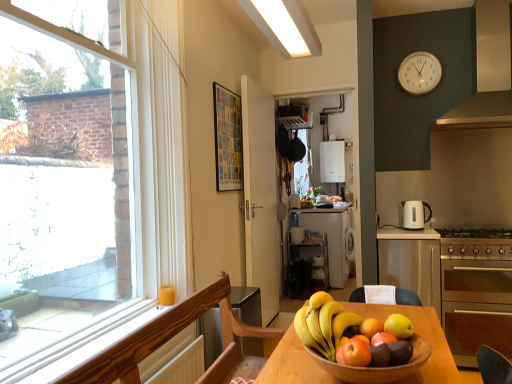
At what (x,y) coordinates should I click in order to perform the action: click on shiny green apple at center, the 2th apple in the front-to-back sequence. Please return your answer as a coordinate pair (x, y). The height and width of the screenshot is (384, 512). Looking at the image, I should click on (380, 355).

Image resolution: width=512 pixels, height=384 pixels. Describe the element at coordinates (308, 266) in the screenshot. I see `black plastic shelf at center, the 2th appliance in the back-to-front sequence` at that location.

Describe the element at coordinates (152, 137) in the screenshot. I see `clear glass window at left` at that location.

I want to click on shiny red apple at lower center, the fourth apple positioned from the back, so click(400, 352).

The image size is (512, 384). What do you see at coordinates (400, 352) in the screenshot?
I see `shiny red apple at lower center, the third apple viewed from the front` at bounding box center [400, 352].

What do you see at coordinates (335, 161) in the screenshot?
I see `white glossy boiler at center, which is the second appliance in left-to-right order` at bounding box center [335, 161].

The image size is (512, 384). What do you see at coordinates (333, 238) in the screenshot?
I see `white matte dishwasher at center` at bounding box center [333, 238].

The image size is (512, 384). I want to click on shiny green apple at center, the 2th apple in the front-to-back sequence, so click(x=380, y=355).

Considering the sizes of objects shiny red apple at center, arranged as the fourth apple when viewed from the front, and shiny yellow apple at center, the first apple when ordered from back to front, in the image provided, who is smaller, shiny red apple at center, arranged as the fourth apple when viewed from the front, or shiny yellow apple at center, the first apple when ordered from back to front,?

shiny red apple at center, arranged as the fourth apple when viewed from the front.

How different are the orientations of shiny red apple at center, arranged as the fourth apple when viewed from the front, and shiny yellow apple at center, the sixth apple when ordered from front to back, in degrees?

180 degrees separate the facing orientations of shiny red apple at center, arranged as the fourth apple when viewed from the front, and shiny yellow apple at center, the sixth apple when ordered from front to back.

From the image's perspective, count 4th apples downward from the shiny yellow apple at center, the sixth apple when ordered from front to back, and point to it. Please provide its 2D coordinates.

[(383, 338)]

Is shiny red apple at center, arranged as the third apple when viewed from the back, facing towards shiny yellow apple at center, the first apple when ordered from back to front?

Yes, shiny red apple at center, arranged as the third apple when viewed from the back, faces towards shiny yellow apple at center, the first apple when ordered from back to front.

From the image's perspective, which is above, wooden bowl at center or shiny red apple at lower center, the third apple viewed from the front?

shiny red apple at lower center, the third apple viewed from the front, is shown above in the image.

Which point is more forward, (346,377) or (398,359)?

The point (346,377) is closer.

Does wooden bowl at center have a lesser width compared to shiny red apple at lower center, the third apple viewed from the front?

No, wooden bowl at center is not thinner than shiny red apple at lower center, the third apple viewed from the front.

Between wooden bowl at center and shiny red apple at lower center, the fourth apple positioned from the back, which one has larger size?

Bigger between the two is wooden bowl at center.

Considering the relative sizes of white glossy electric kettle at right and satin silver exhaust hood at upper right in the image provided, is white glossy electric kettle at right smaller than satin silver exhaust hood at upper right?

Correct, white glossy electric kettle at right occupies less space than satin silver exhaust hood at upper right.

Considering the sizes of objects white glossy electric kettle at right and satin silver exhaust hood at upper right in the image provided, who is thinner, white glossy electric kettle at right or satin silver exhaust hood at upper right?

With smaller width is white glossy electric kettle at right.

Considering the positions of objects white glossy electric kettle at right and satin silver exhaust hood at upper right in the image provided, who is more to the left, white glossy electric kettle at right or satin silver exhaust hood at upper right?

Positioned to the left is white glossy electric kettle at right.

Is satin silver exhaust hood at upper right surrounded by white glossy electric kettle at right?

No, satin silver exhaust hood at upper right is not surrounded by white glossy electric kettle at right.

Would you say wooden chair at lower left is inside or outside shiny red apple at center, arranged as the fourth apple when viewed from the front?

wooden chair at lower left is not enclosed by shiny red apple at center, arranged as the fourth apple when viewed from the front.

Which of these two, wooden chair at lower left or shiny red apple at center, arranged as the third apple when viewed from the back, stands shorter?

shiny red apple at center, arranged as the third apple when viewed from the back, is shorter.

Consider the image. Is wooden chair at lower left further to the viewer compared to shiny red apple at center, arranged as the fourth apple when viewed from the front?

No, wooden chair at lower left is in front of shiny red apple at center, arranged as the fourth apple when viewed from the front.

Locate an element on the screen. chair in front of the shiny red apple at center, arranged as the fourth apple when viewed from the front is located at coordinates (163, 337).

Does white matte door at center have a lesser width compared to white glossy boiler at center, which is the first appliance from right to left?

Yes, white matte door at center is thinner than white glossy boiler at center, which is the first appliance from right to left.

At what (x,y) coordinates should I click in order to perform the action: click on appliance that is the 2nd object located behind the white matte door at center. Please return your answer as a coordinate pair (x, y). The image size is (512, 384). Looking at the image, I should click on (335, 161).

Is white matte door at center not inside white glossy boiler at center, which appears as the 1th appliance when viewed from the top?

Yes, white matte door at center is not within white glossy boiler at center, which appears as the 1th appliance when viewed from the top.

Could you tell me if white matte door at center is facing white glossy boiler at center, which appears as the 1th appliance when viewed from the top?

No, white matte door at center is not oriented towards white glossy boiler at center, which appears as the 1th appliance when viewed from the top.

Is white glossy boiler at center, which is the first appliance from right to left, in front of or behind shiny red apple at center, arranged as the third apple when viewed from the back, in the image?

white glossy boiler at center, which is the first appliance from right to left, is behind shiny red apple at center, arranged as the third apple when viewed from the back.

Between white glossy boiler at center, which is the 2th appliance in bottom-to-top order, and shiny red apple at center, arranged as the fourth apple when viewed from the front, which one has larger size?

white glossy boiler at center, which is the 2th appliance in bottom-to-top order, is bigger.

Considering the relative positions of white glossy boiler at center, which is the second appliance in left-to-right order, and shiny red apple at center, arranged as the third apple when viewed from the back, in the image provided, is white glossy boiler at center, which is the second appliance in left-to-right order, to the right of shiny red apple at center, arranged as the third apple when viewed from the back, from the viewer's perspective?

Correct, you'll find white glossy boiler at center, which is the second appliance in left-to-right order, to the right of shiny red apple at center, arranged as the third apple when viewed from the back.

Is stainless steel gas stove at right next to satin silver cabinet at right?

stainless steel gas stove at right is not next to satin silver cabinet at right, and they're not touching.

From their relative heights in the image, would you say stainless steel gas stove at right is taller or shorter than satin silver cabinet at right?

stainless steel gas stove at right is shorter than satin silver cabinet at right.

Is satin silver cabinet at right at the back of stainless steel gas stove at right?

No, stainless steel gas stove at right's orientation is not away from satin silver cabinet at right.

Is stainless steel gas stove at right thinner than satin silver cabinet at right?

Correct, the width of stainless steel gas stove at right is less than that of satin silver cabinet at right.

This screenshot has height=384, width=512. I want to click on the 4th apple located beneath the shiny yellow apple at center, the sixth apple when ordered from front to back (from a real-world perspective), so click(383, 338).

At what (x,y) coordinates should I click in order to perform the action: click on the 3rd apple behind the wooden bowl at center. Please return your answer as a coordinate pair (x, y). Looking at the image, I should click on (400, 352).

From the image, which object appears to be farther from wooden chair at lower left, wooden bowl at center or shiny yellow apple at center, the first apple when ordered from back to front?

wooden bowl at center is positioned further to the anchor wooden chair at lower left.

From the image, which object appears to be farther from wooden bowl at center, satin silver exhaust hood at upper right or white matte door at center?

Based on the image, satin silver exhaust hood at upper right appears to be further to wooden bowl at center.

When comparing their distances from wooden chair at lower left, does shiny red apple at center, arranged as the third apple when viewed from the back, or stainless steel oven at right seem further?

stainless steel oven at right is positioned further to the anchor wooden chair at lower left.

From the image, which object appears to be farther from stainless steel oven at right, shiny red apple at center, arranged as the fourth apple when viewed from the front, or shiny yellow apple at center, the sixth apple when ordered from front to back?

Based on the image, shiny red apple at center, arranged as the fourth apple when viewed from the front, appears to be further to stainless steel oven at right.

Considering their positions, is white matte dishwasher at center positioned closer to shiny red apple at center, arranged as the fourth apple when viewed from the front, than yellow matte apple at center, the fifth apple in the front-to-back sequence?

yellow matte apple at center, the fifth apple in the front-to-back sequence, lies closer to shiny red apple at center, arranged as the fourth apple when viewed from the front, than the other object.

Considering their positions, is white matte door at center positioned closer to shiny yellow apple at center, the sixth apple when ordered from front to back, than wooden bowl at center?

The object closer to shiny yellow apple at center, the sixth apple when ordered from front to back, is wooden bowl at center.

Consider the image. From the image, which object appears to be farther from shiny green apple at center, acting as the fifth apple starting from the back, white matte door at center or shiny red apple at center, arranged as the fourth apple when viewed from the front?

white matte door at center is positioned further to the anchor shiny green apple at center, acting as the fifth apple starting from the back.

Looking at the image, which one is located closer to white plastic clock at upper right, stainless steel gas stove at right or satin silver exhaust hood at upper right?

satin silver exhaust hood at upper right.

In order to click on cabinetry positioned between matte red apple at center, arranged as the first apple when viewed from the front, and white glossy boiler at center, which is the first appliance from right to left, from near to far in this screenshot , I will do `click(411, 262)`.

Identify the location of apple located between wooden bowl at center and shiny green apple at center, acting as the fifth apple starting from the back, in the depth direction. (354, 353).

Where is `exhaust hood between wooden bowl at center and white glossy electric kettle at right along the z-axis`? exhaust hood between wooden bowl at center and white glossy electric kettle at right along the z-axis is located at coordinates (488, 72).

The width and height of the screenshot is (512, 384). I want to click on kitchen appliance between matte red apple at center, the sixth apple when ordered from back to front, and black plastic shelf at center, the 2th appliance in the back-to-front sequence, from front to back, so click(x=415, y=214).